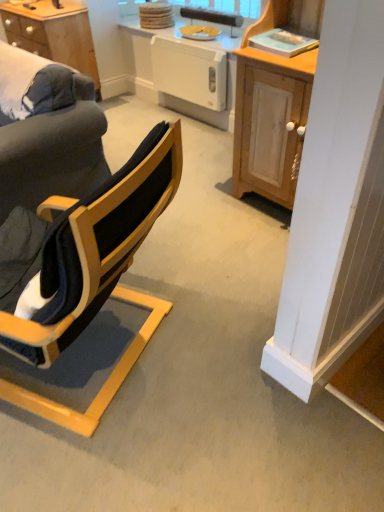
Question: Considering the relative positions of light wood cabinet at right and yellow matte plate at upper center in the image provided, is light wood cabinet at right to the left or to the right of yellow matte plate at upper center?

Choices:
 (A) right
 (B) left

Answer: (A)

Question: Relative to yellow matte plate at upper center, is light wood cabinet at right in front or behind?

Choices:
 (A) behind
 (B) front

Answer: (B)

Question: Which of these objects is positioned closest to the light wood cabinet at right?

Choices:
 (A) white plastic dishwasher at center
 (B) yellow matte plate at upper center
 (C) white glossy radiator at center
 (D) matte black chair at left
 (E) wooden desk at upper left

Answer: (A)

Question: Considering the real-world distances, which object is closest to the white glossy radiator at center?

Choices:
 (A) matte black chair at left
 (B) yellow matte plate at upper center
 (C) wooden desk at upper left
 (D) light wood cabinet at right
 (E) white plastic dishwasher at center

Answer: (E)